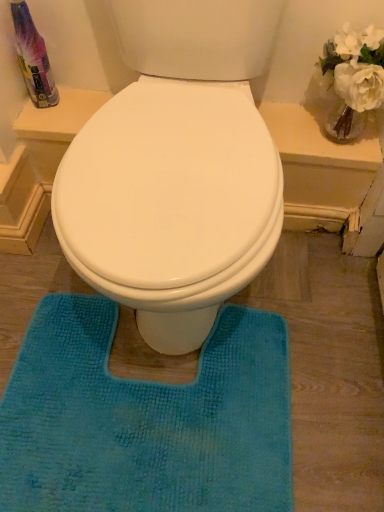
What do you see at coordinates (145, 419) in the screenshot? The width and height of the screenshot is (384, 512). I see `teal plush bath mat at center` at bounding box center [145, 419].

Where is `teal plush bath mat at center`? The width and height of the screenshot is (384, 512). teal plush bath mat at center is located at coordinates (145, 419).

Measure the distance between point (41, 57) and camera.

The depth of point (41, 57) is 36.02 inches.

What is the approximate width of translucent plastic spray bottle at upper left?

translucent plastic spray bottle at upper left is 4.10 inches in width.

This screenshot has height=512, width=384. What do you see at coordinates (33, 57) in the screenshot? I see `translucent plastic spray bottle at upper left` at bounding box center [33, 57].

Where is `translucent plastic spray bottle at upper left`? The width and height of the screenshot is (384, 512). translucent plastic spray bottle at upper left is located at coordinates (33, 57).

This screenshot has width=384, height=512. I want to click on teal plush bath mat at center, so click(145, 419).

In the scene shown: Between teal plush bath mat at center and translucent plastic spray bottle at upper left, which one appears on the left side from the viewer's perspective?

translucent plastic spray bottle at upper left.

Based on the photo, in the image, is teal plush bath mat at center positioned in front of or behind translucent plastic spray bottle at upper left?

Clearly, teal plush bath mat at center is in front of translucent plastic spray bottle at upper left.

Does point (131, 504) lie in front of point (15, 18)?

Yes, point (131, 504) is closer to viewer.

From the image's perspective, relative to translucent plastic spray bottle at upper left, is teal plush bath mat at center above or below?

From the image's perspective, teal plush bath mat at center appears below translucent plastic spray bottle at upper left.

From a real-world perspective, is teal plush bath mat at center beneath translucent plastic spray bottle at upper left?

Indeed, from a real-world perspective, teal plush bath mat at center is positioned beneath translucent plastic spray bottle at upper left.

Based on the photo, does teal plush bath mat at center have a greater width compared to translucent plastic spray bottle at upper left?

Yes.

Which of these two, teal plush bath mat at center or translucent plastic spray bottle at upper left, stands shorter?

Standing shorter between the two is teal plush bath mat at center.

Who is bigger, teal plush bath mat at center or translucent plastic spray bottle at upper left?

teal plush bath mat at center is bigger.

Is teal plush bath mat at center completely or partially outside of translucent plastic spray bottle at upper left?

Yes, teal plush bath mat at center is located beyond the bounds of translucent plastic spray bottle at upper left.

Is teal plush bath mat at center not close to translucent plastic spray bottle at upper left?

That's not correct — teal plush bath mat at center is a little close to translucent plastic spray bottle at upper left.

Is teal plush bath mat at center aimed at translucent plastic spray bottle at upper left?

No, teal plush bath mat at center does not turn towards translucent plastic spray bottle at upper left.

How much distance is there between teal plush bath mat at center and translucent plastic spray bottle at upper left?

teal plush bath mat at center and translucent plastic spray bottle at upper left are 27.75 inches apart from each other.

Identify the location of bath mat in front of the translucent plastic spray bottle at upper left. (145, 419).

Which object is positioned more to the right, translucent plastic spray bottle at upper left or teal plush bath mat at center?

From the viewer's perspective, teal plush bath mat at center appears more on the right side.

Is translucent plastic spray bottle at upper left behind teal plush bath mat at center?

Yes, it is behind teal plush bath mat at center.

Is point (47, 95) less distant than point (69, 478)?

No, it is not.

From the image's perspective, between translucent plastic spray bottle at upper left and teal plush bath mat at center, who is located below?

teal plush bath mat at center is shown below in the image.

Looking at this image, from a real-world perspective, relative to teal plush bath mat at center, is translucent plastic spray bottle at upper left vertically above or below?

translucent plastic spray bottle at upper left is above teal plush bath mat at center.

Which object is wider, translucent plastic spray bottle at upper left or teal plush bath mat at center?

teal plush bath mat at center.

Looking at this image, in terms of height, does translucent plastic spray bottle at upper left look taller or shorter compared to teal plush bath mat at center?

translucent plastic spray bottle at upper left is taller than teal plush bath mat at center.

From the picture: Between translucent plastic spray bottle at upper left and teal plush bath mat at center, which one has smaller size?

translucent plastic spray bottle at upper left is smaller.

Is translucent plastic spray bottle at upper left located outside teal plush bath mat at center?

translucent plastic spray bottle at upper left lies outside teal plush bath mat at center's area.

In the scene shown: Is the surface of translucent plastic spray bottle at upper left in direct contact with teal plush bath mat at center?

No.

Does translucent plastic spray bottle at upper left turn towards teal plush bath mat at center?

No, translucent plastic spray bottle at upper left is not facing towards teal plush bath mat at center.

What's the angular difference between translucent plastic spray bottle at upper left and teal plush bath mat at center's facing directions?

The facing directions of translucent plastic spray bottle at upper left and teal plush bath mat at center are 0.785 degrees apart.

Where is `bath mat in front of the translucent plastic spray bottle at upper left`? This screenshot has height=512, width=384. bath mat in front of the translucent plastic spray bottle at upper left is located at coordinates (145, 419).

At what (x,y) coordinates should I click in order to perform the action: click on cleaning product located above the teal plush bath mat at center (from the image's perspective). Please return your answer as a coordinate pair (x, y). Image resolution: width=384 pixels, height=512 pixels. Looking at the image, I should click on (33, 57).

Image resolution: width=384 pixels, height=512 pixels. I want to click on bath mat below the translucent plastic spray bottle at upper left (from a real-world perspective), so click(145, 419).